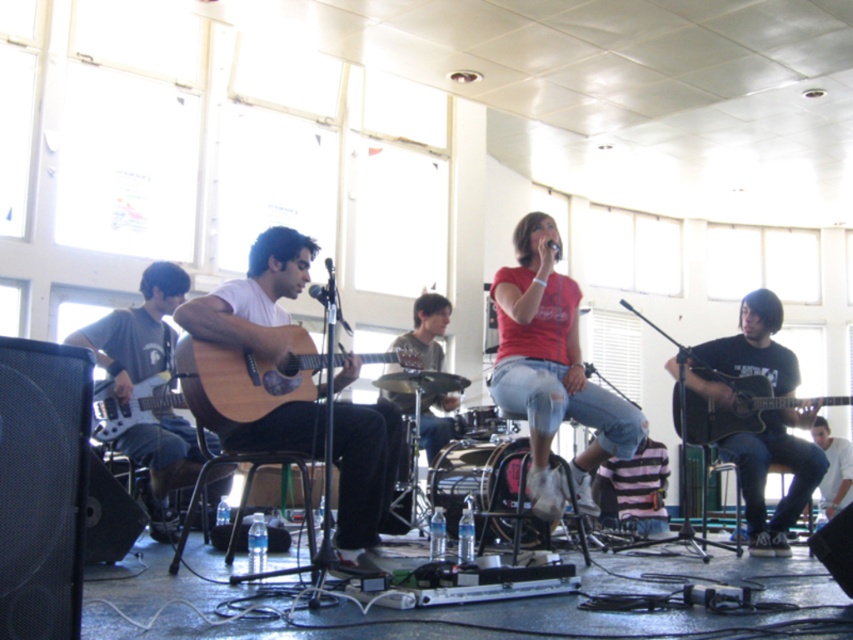
You are a photographer setting up equipment in the middle of the stage. You need to place a camera stand that requires at least 1 meter of space between the natural wood acoustic guitar at center and the white matte shirt at lower right. Based on their positions, do you think there is enough space?

The natural wood acoustic guitar at center might be wider than white matte shirt at lower right, so there may not be enough space for the camera stand between them. Check the actual distance before setting up.

You are a photographer at the live music performance. You need to capture a photo that includes both the natural wood acoustic guitar at center and the white matte shirt at lower right. Based on their positions, which object should you place on the left side of your photo frame?

The natural wood acoustic guitar at center should be placed on the left side of the photo frame because it is to the left of the white matte shirt at lower right.